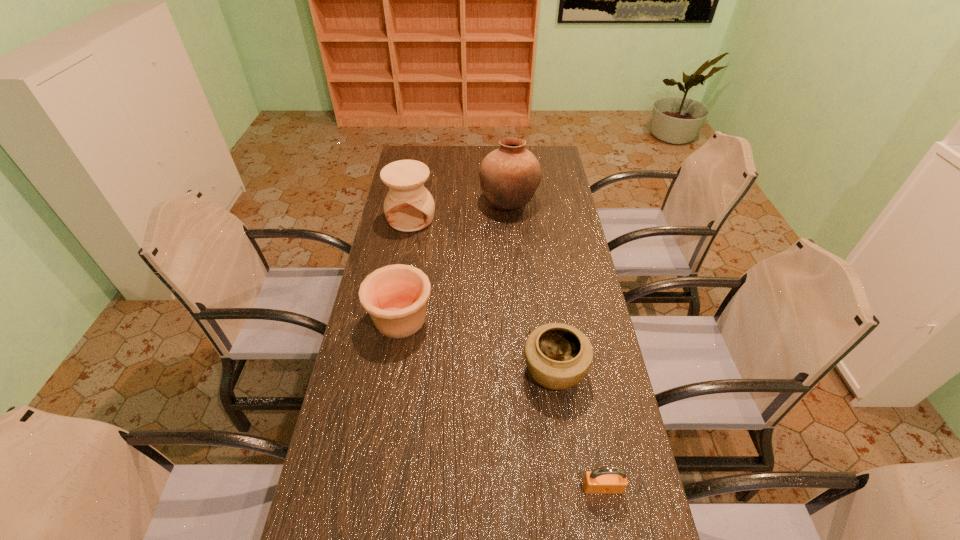
Identify the location of the tallest object. (509, 176).

The height and width of the screenshot is (540, 960). Find the location of `the third shortest pottery`. the third shortest pottery is located at coordinates (409, 206).

You are a GUI agent. You are given a task and a screenshot of the screen. Output one action in this format:
    pyautogui.click(x=<x>, y=<y>)
    Task: Click on the padlock
    This screenshot has width=960, height=540.
    Given the screenshot: What is the action you would take?
    pyautogui.click(x=610, y=479)

Find the location of a particular element. This screenshot has width=960, height=540. the shortest object is located at coordinates (610, 479).

Where is `vacant area situated on the front of the tallest object`? vacant area situated on the front of the tallest object is located at coordinates (516, 282).

This screenshot has height=540, width=960. In order to click on free space located at the open side of the second tallest object in this screenshot , I will do `click(400, 276)`.

The height and width of the screenshot is (540, 960). I want to click on vacant area located to unlock the shortest object from the front, so click(x=609, y=522).

Locate an element on the screen. The height and width of the screenshot is (540, 960). padlock positioned at the right edge is located at coordinates tap(610, 479).

In the image, there is a desktop. Where is `vacant space at the far edge`? Image resolution: width=960 pixels, height=540 pixels. vacant space at the far edge is located at coordinates (494, 149).

You are a GUI agent. You are given a task and a screenshot of the screen. Output one action in this format:
    pyautogui.click(x=<x>, y=<y>)
    Task: Click on the vacant point at the left edge
    
    Given the screenshot: What is the action you would take?
    pyautogui.click(x=378, y=372)